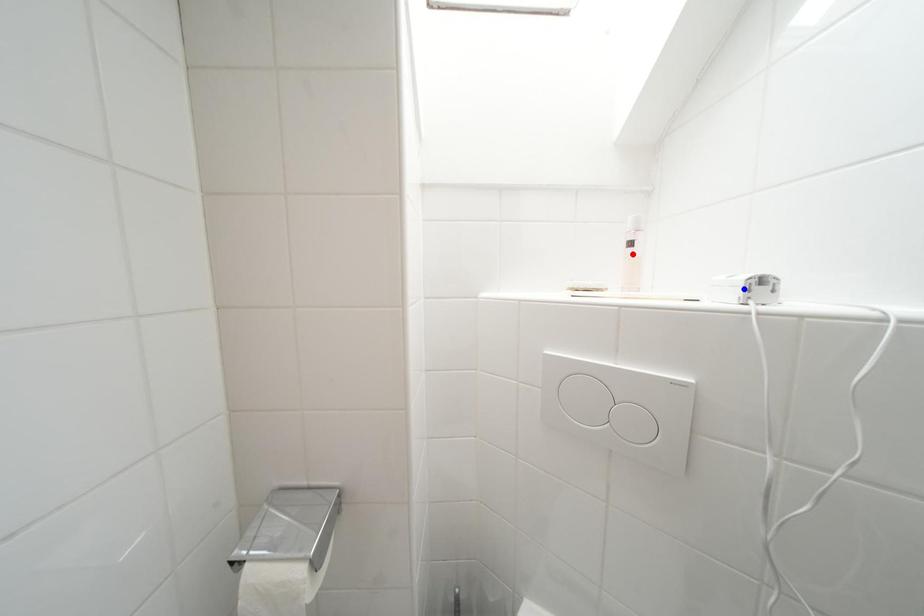
Question: In the image, two points are highlighted. Which point is nearer to the camera? Reply with the corresponding letter.

Choices:
 (A) blue point
 (B) red point

Answer: (A)